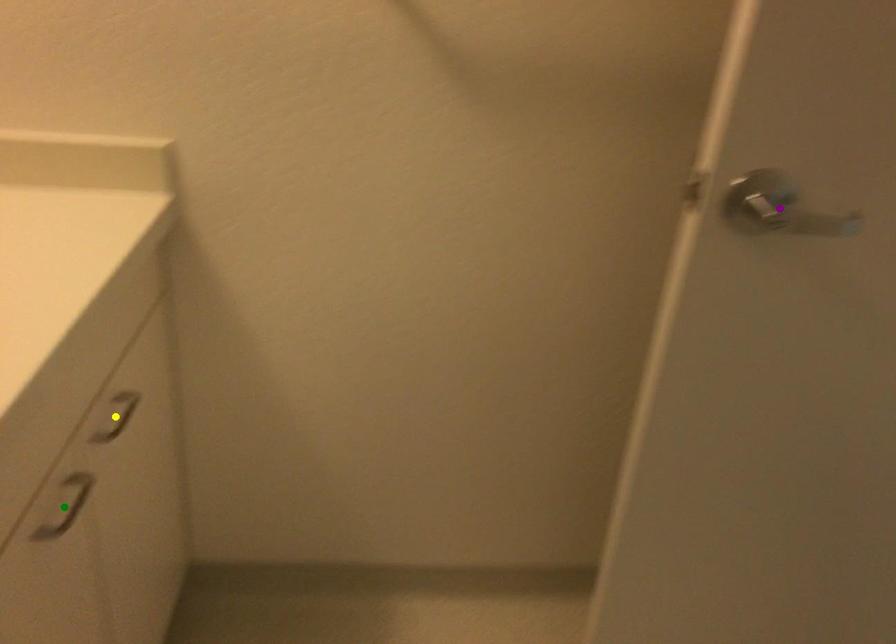
Order these from nearest to farthest:
- purple point
- yellow point
- green point

green point → purple point → yellow point